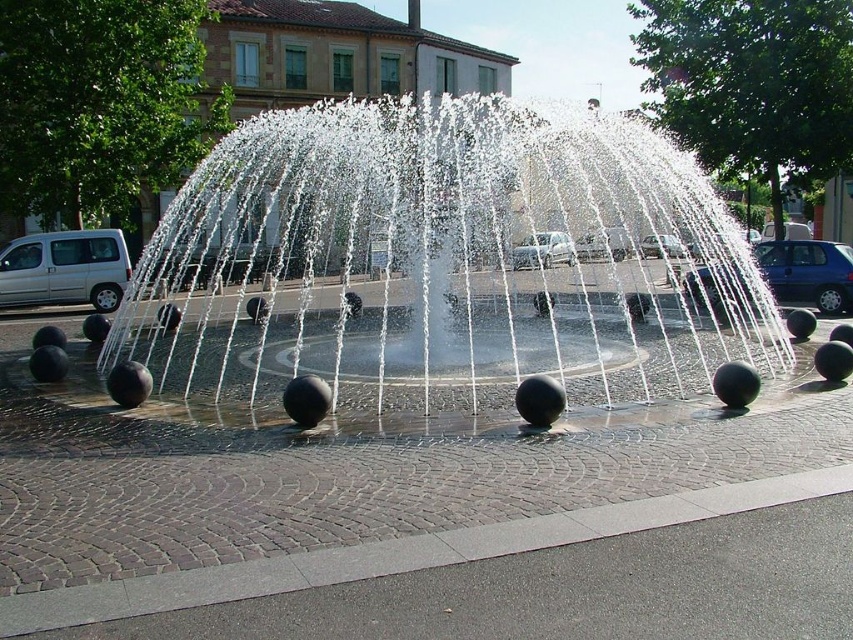
Is black polished spheres at center bigger than blue metallic car at right?

Yes.

Does black polished spheres at center have a lesser width compared to blue metallic car at right?

No, black polished spheres at center is not thinner than blue metallic car at right.

Is point (495, 198) positioned after point (830, 294)?

No, it is not.

The width and height of the screenshot is (853, 640). What are the coordinates of `black polished spheres at center` in the screenshot? It's located at (434, 262).

Which is below, silver metallic van at left or silver metallic sedan at center?

silver metallic van at left is lower down.

Is silver metallic van at left positioned behind silver metallic sedan at center?

Yes, silver metallic van at left is behind silver metallic sedan at center.

Does point (0, 291) come farther from viewer compared to point (653, 250)?

No, (0, 291) is closer to viewer.

In order to click on silver metallic van at left in this screenshot , I will do `click(64, 269)`.

Can you confirm if silver metallic car at center is positioned above silver metallic sedan at center?

Incorrect, silver metallic car at center is not positioned above silver metallic sedan at center.

Between silver metallic car at center and silver metallic sedan at center, which one appears on the right side from the viewer's perspective?

Positioned to the right is silver metallic sedan at center.

Between point (550, 248) and point (680, 250), which one is positioned behind?

Point (550, 248)

Identify the location of silver metallic car at center. (543, 250).